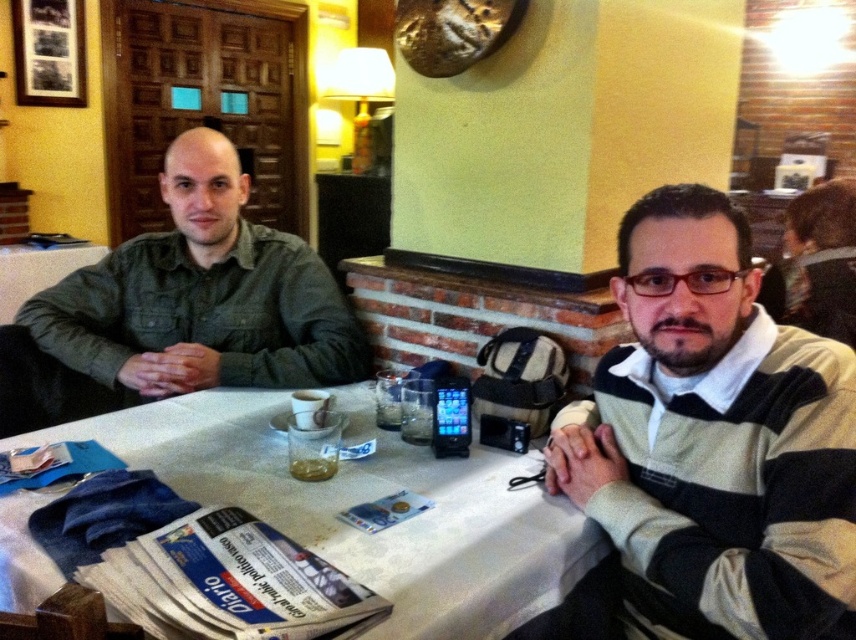
Question: Does white textured table at center have a greater width compared to green denim shirt at left?

Choices:
 (A) yes
 (B) no

Answer: (A)

Question: Among these objects, which one is nearest to the camera?

Choices:
 (A) white textured table at center
 (B) green denim shirt at left
 (C) striped sweater at center

Answer: (C)

Question: Among these points, which one is nearest to the camera?

Choices:
 (A) (574, 532)
 (B) (168, 288)
 (C) (676, 276)

Answer: (C)

Question: Where is white textured table at center located in relation to green denim shirt at left in the image?

Choices:
 (A) above
 (B) below

Answer: (B)

Question: Which point is farther to the camera?

Choices:
 (A) white textured table at center
 (B) green denim shirt at left

Answer: (B)

Question: In this image, where is white textured table at center located relative to green denim shirt at left?

Choices:
 (A) above
 (B) below

Answer: (B)